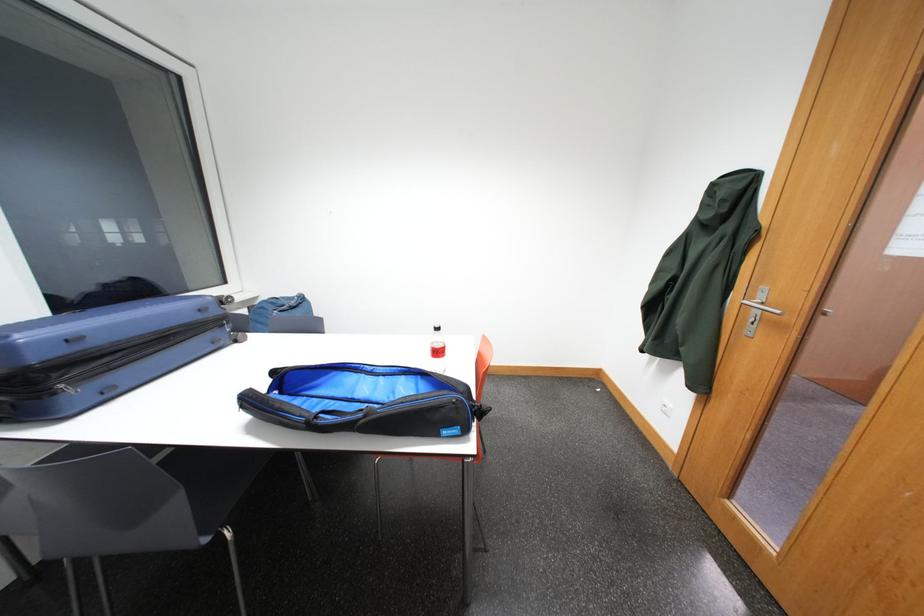
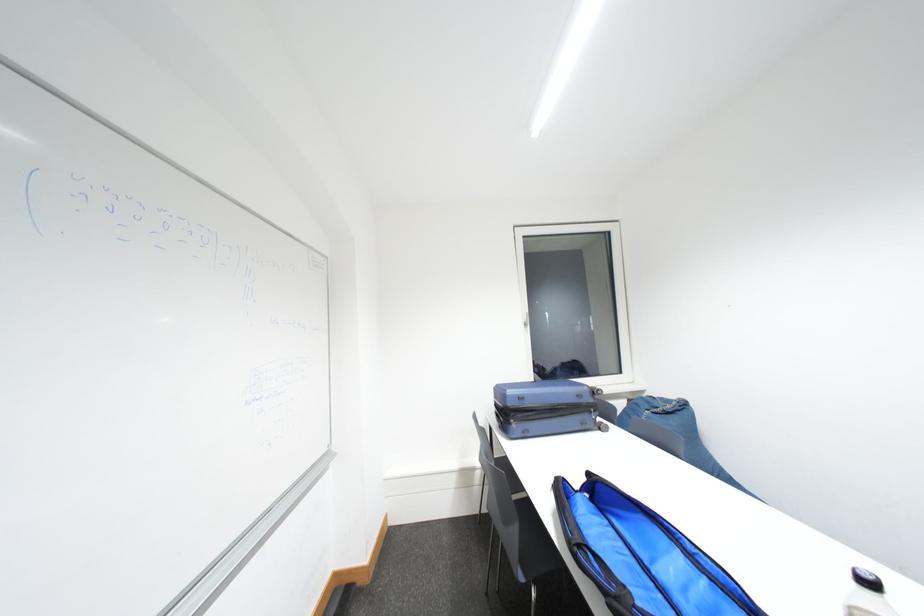
Question: The camera is either moving clockwise (left) or counter-clockwise (right) around the object. The first image is from the beginning of the video and the second image is from the end. Is the camera moving left or right when shooting the video?

Choices:
 (A) Left
 (B) Right

Answer: (B)